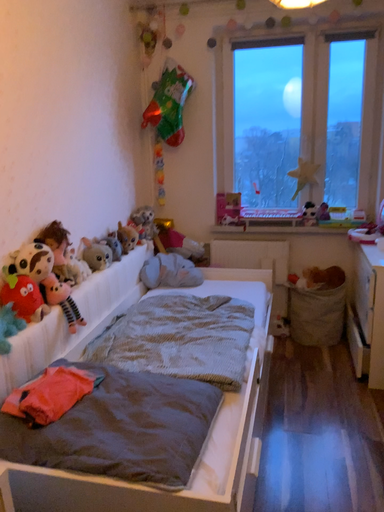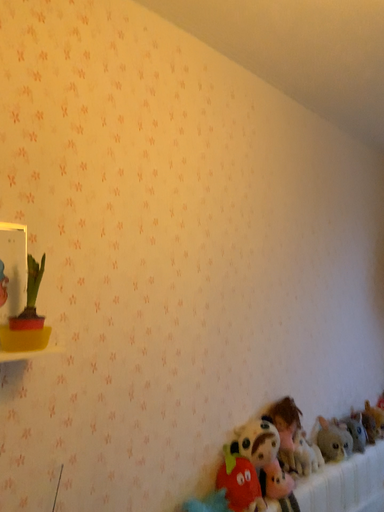
Question: Which way did the camera rotate in the video?

Choices:
 (A) rotated left
 (B) rotated right

Answer: (A)